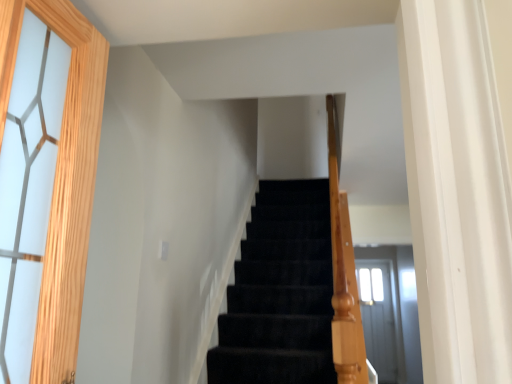
What do you see at coordinates (63, 178) in the screenshot?
I see `clear glass door at left` at bounding box center [63, 178].

You are a GUI agent. You are given a task and a screenshot of the screen. Output one action in this format:
    pyautogui.click(x=<x>, y=<y>)
    Task: Click on the clear glass door at left
    
    Given the screenshot: What is the action you would take?
    pyautogui.click(x=63, y=178)

In the scene shown: What is the approximate height of clear glass door at left?

It is 31.76 inches.

Find the location of a particular element. This screenshot has width=512, height=384. clear glass door at left is located at coordinates (63, 178).